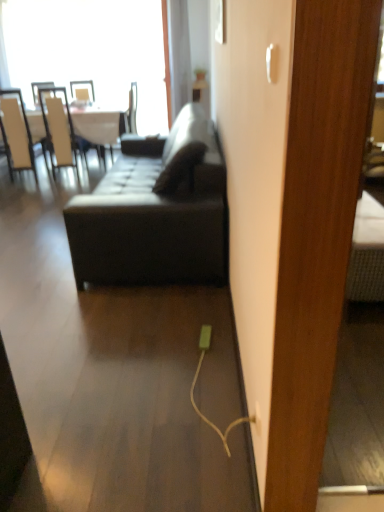
The image size is (384, 512). Describe the element at coordinates (257, 419) in the screenshot. I see `white plastic electric outlet at lower center` at that location.

I want to click on matte black couch at center, so click(155, 211).

The width and height of the screenshot is (384, 512). I want to click on white glossy table at upper left, so click(x=97, y=124).

Is white glossy table at upper left in front of or behind transparent glass window at upper left in the image?

Clearly, white glossy table at upper left is in front of transparent glass window at upper left.

Is transparent glass window at upper left at the back of white glossy table at upper left?

That's right, white glossy table at upper left is facing away from transparent glass window at upper left.

Identify the location of table in front of the transparent glass window at upper left. (97, 124).

From a real-world perspective, is white glossy table at upper left above or below white plastic electric outlet at lower center?

From a real-world perspective, white glossy table at upper left is physically above white plastic electric outlet at lower center.

Is white glossy table at upper left looking in the opposite direction of white plastic electric outlet at lower center?

That's not correct — white glossy table at upper left is not looking away from white plastic electric outlet at lower center.

Looking at this image, which is more to the left, white glossy table at upper left or white plastic electric outlet at lower center?

From the viewer's perspective, white glossy table at upper left appears more on the left side.

Based on the photo, how many degrees apart are the facing directions of white glossy table at upper left and white plastic electric outlet at lower center?

The facing directions of white glossy table at upper left and white plastic electric outlet at lower center are 92.3 degrees apart.

From the image's perspective, which one is positioned lower, transparent glass window at upper left or white plastic electric outlet at lower center?

white plastic electric outlet at lower center is shown below in the image.

Considering the relative positions of transparent glass window at upper left and white plastic electric outlet at lower center in the image provided, is transparent glass window at upper left in front of white plastic electric outlet at lower center?

That is False.

From a real-world perspective, is transparent glass window at upper left physically above white plastic electric outlet at lower center?

Indeed, from a real-world perspective, transparent glass window at upper left stands above white plastic electric outlet at lower center.

Could you measure the distance between white leather chair at left, the 1th chair viewed from the right, and white leather chair at left, which ranks as the 2th chair in right-to-left order?

They are 62.58 centimeters apart.

Who is bigger, white leather chair at left, the 1th chair viewed from the right, or white leather chair at left, which ranks as the 2th chair in right-to-left order?

white leather chair at left, the 1th chair viewed from the right, is bigger.

From a real-world perspective, is white leather chair at left, the 2th chair in the left-to-right sequence, positioned under white leather chair at left, which ranks as the 2th chair in right-to-left order, based on gravity?

Yes, from a real-world perspective, white leather chair at left, the 2th chair in the left-to-right sequence, is beneath white leather chair at left, which ranks as the 2th chair in right-to-left order.

From the image's perspective, is white leather chair at left, the 2th chair in the left-to-right sequence, located above white leather chair at left, which ranks as the 2th chair in right-to-left order?

Yes, from the image's perspective, white leather chair at left, the 2th chair in the left-to-right sequence, is over white leather chair at left, which ranks as the 2th chair in right-to-left order.

Identify the location of the 1st chair to the left when counting from the matte black couch at center. (x=63, y=130).

Can you confirm if white leather chair at left, the 1th chair viewed from the right, is shorter than matte black couch at center?

No, white leather chair at left, the 1th chair viewed from the right, is not shorter than matte black couch at center.

Is white leather chair at left, the 1th chair viewed from the right, not near matte black couch at center?

Yes, white leather chair at left, the 1th chair viewed from the right, is far from matte black couch at center.

Is transparent glass window at upper left in front of or behind white leather chair at left, the 1th chair viewed from the right, in the image?

Clearly, transparent glass window at upper left is behind white leather chair at left, the 1th chair viewed from the right.

Is transparent glass window at upper left positioned with its back to white leather chair at left, the 2th chair in the left-to-right sequence?

No.

Considering the relative sizes of transparent glass window at upper left and white leather chair at left, the 1th chair viewed from the right, in the image provided, is transparent glass window at upper left shorter than white leather chair at left, the 1th chair viewed from the right,?

Incorrect, the height of transparent glass window at upper left does not fall short of that of white leather chair at left, the 1th chair viewed from the right.

Could you measure the distance between white leather chair at left, which appears as the 1th chair when viewed from the left, and transparent glass window at upper left?

white leather chair at left, which appears as the 1th chair when viewed from the left, and transparent glass window at upper left are 1.31 meters apart.

This screenshot has width=384, height=512. There is a white leather chair at left, which appears as the 1th chair when viewed from the left. Identify the location of window above it (from a real-world perspective). (88, 51).

Does white leather chair at left, which appears as the 1th chair when viewed from the left, appear on the left side of transparent glass window at upper left?

Correct, you'll find white leather chair at left, which appears as the 1th chair when viewed from the left, to the left of transparent glass window at upper left.

Is white leather chair at left, which appears as the 1th chair when viewed from the left, positioned in front of transparent glass window at upper left?

Yes, white leather chair at left, which appears as the 1th chair when viewed from the left, is closer to the camera.

Locate an element on the screen. This screenshot has width=384, height=512. window behind the white glossy table at upper left is located at coordinates (88, 51).

I want to click on table above the white plastic electric outlet at lower center (from the image's perspective), so click(97, 124).

From the image, which object appears to be nearer to matte black couch at center, white plastic electric outlet at lower center or white leather chair at left, which ranks as the 2th chair in right-to-left order?

white plastic electric outlet at lower center is closer to matte black couch at center.

Looking at the image, which one is located closer to white leather chair at left, which ranks as the 2th chair in right-to-left order, white glossy table at upper left or transparent glass window at upper left?

white glossy table at upper left lies closer to white leather chair at left, which ranks as the 2th chair in right-to-left order, than the other object.

Estimate the real-world distances between objects in this image. Which object is closer to white leather chair at left, which appears as the 1th chair when viewed from the left, white plastic electric outlet at lower center or matte black couch at center?

matte black couch at center is closer to white leather chair at left, which appears as the 1th chair when viewed from the left.

Which object lies further to the anchor point transparent glass window at upper left, white plastic electric outlet at lower center or white glossy table at upper left?

white plastic electric outlet at lower center lies further to transparent glass window at upper left than the other object.

Based on their spatial positions, is white leather chair at left, which ranks as the 2th chair in right-to-left order, or transparent glass window at upper left closer to white plastic electric outlet at lower center?

white leather chair at left, which ranks as the 2th chair in right-to-left order, is positioned closer to the anchor white plastic electric outlet at lower center.

Looking at the image, which one is located closer to transparent glass window at upper left, white leather chair at left, which ranks as the 2th chair in right-to-left order, or matte black couch at center?

white leather chair at left, which ranks as the 2th chair in right-to-left order, is positioned closer to the anchor transparent glass window at upper left.

Which object lies further to the anchor point transparent glass window at upper left, white leather chair at left, the 2th chair in the left-to-right sequence, or white leather chair at left, which ranks as the 2th chair in right-to-left order?

white leather chair at left, which ranks as the 2th chair in right-to-left order, is further to transparent glass window at upper left.

Which object lies nearer to the anchor point transparent glass window at upper left, white glossy table at upper left or white leather chair at left, the 1th chair viewed from the right?

Among the two, white leather chair at left, the 1th chair viewed from the right, is located nearer to transparent glass window at upper left.

Find the location of a particular element. The height and width of the screenshot is (512, 384). table that lies between transparent glass window at upper left and white leather chair at left, which appears as the 1th chair when viewed from the left, from top to bottom is located at coordinates (97, 124).

Identify the location of studio couch located between white plastic electric outlet at lower center and transparent glass window at upper left in the depth direction. (155, 211).

The height and width of the screenshot is (512, 384). What are the coordinates of `studio couch positioned between white plastic electric outlet at lower center and white leather chair at left, the 1th chair viewed from the right, from near to far` in the screenshot? It's located at (155, 211).

Identify the location of chair between transparent glass window at upper left and white glossy table at upper left in the up-down direction. (63, 130).